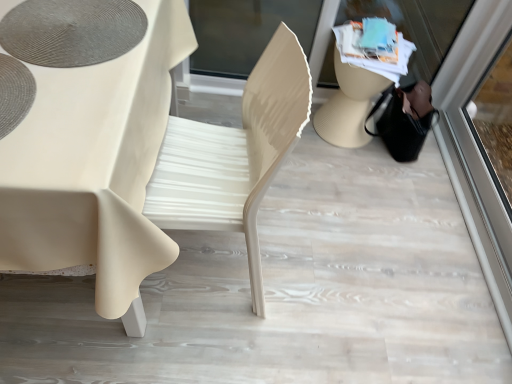
Image resolution: width=512 pixels, height=384 pixels. I want to click on free space in front of matte gray placemat at upper left, so click(71, 107).